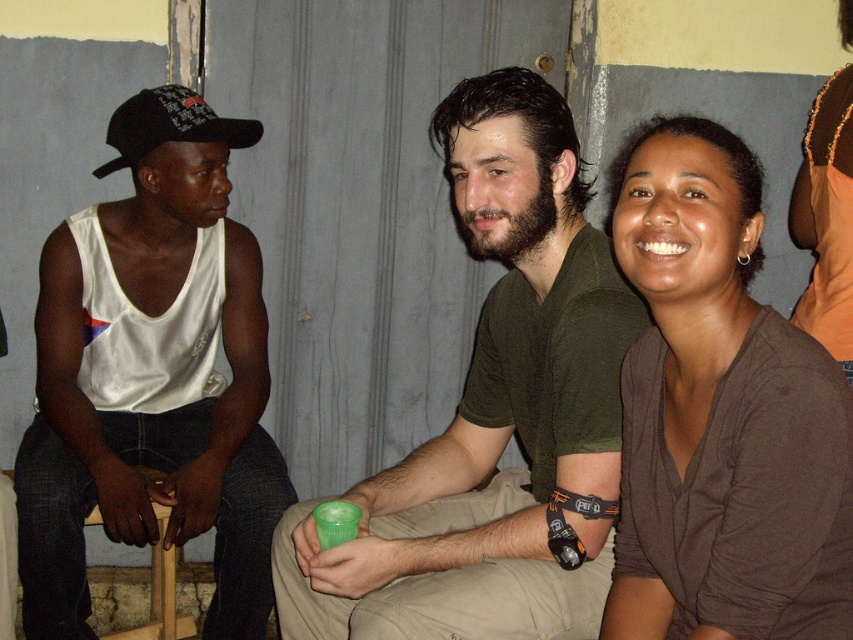
Question: Does green matte cup at center have a greater width compared to black matte baseball cap at left?

Choices:
 (A) yes
 (B) no

Answer: (A)

Question: Where is white matte tank top at left located in relation to brown soft shirt at upper right in the image?

Choices:
 (A) below
 (B) above

Answer: (A)

Question: Which of the following is the closest to the observer?

Choices:
 (A) black matte baseball cap at left
 (B) wooden chair at lower left

Answer: (B)

Question: Observing the image, what is the correct spatial positioning of green matte cup at center in reference to black matte baseball cap at left?

Choices:
 (A) right
 (B) left

Answer: (A)

Question: Which point appears closest to the camera in this image?

Choices:
 (A) (814, 433)
 (B) (161, 561)

Answer: (A)

Question: Which object is closer to the camera taking this photo?

Choices:
 (A) brown soft shirt at upper right
 (B) green matte cup at center
 (C) wooden chair at lower left

Answer: (A)